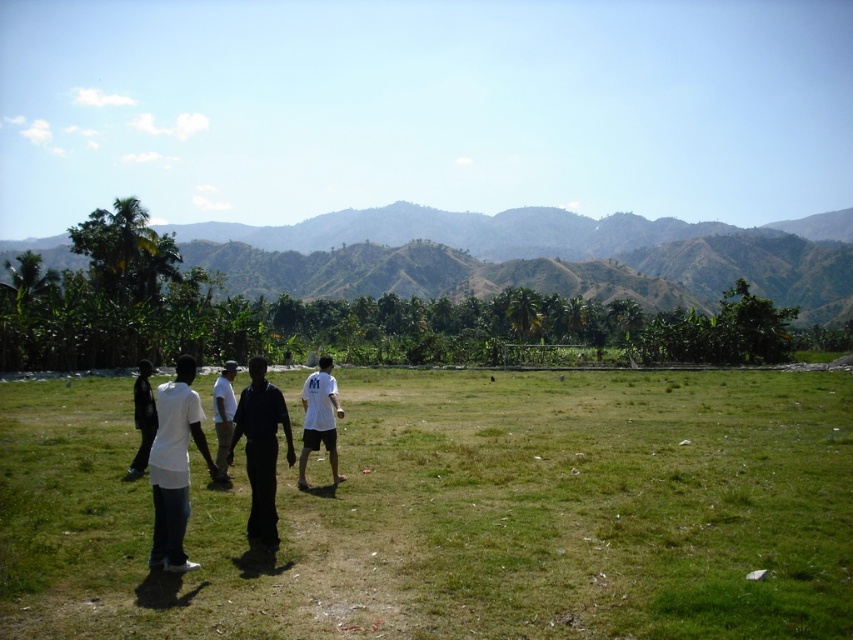
You are a photographer wanting to capture a photo of the green leafy mountain at center and the white matte shirt at center. Which object will appear wider in the photo?

The green leafy mountain at center will appear wider in the photo because its width is larger than that of the white matte shirt at center.

You are standing on the grassy field and see the white matte shirt at lower left and the black matte pants at center. Which object is positioned to the left of the other?

The white matte shirt at lower left is positioned to the left of the black matte pants at center.

You are standing on the grassy field and see the green leafy mountain at center and the white matte shirt at center. Which object is closer to you?

The green leafy mountain at center is closer because the white matte shirt at center is behind it.